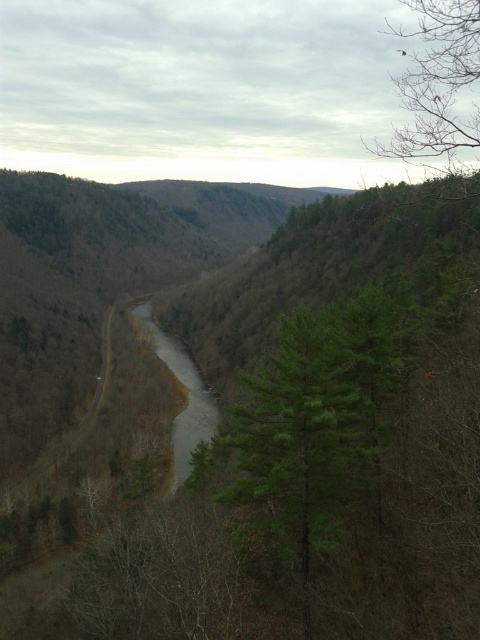
Looking at this image, between green leafy tree at upper right and gray smooth creek at center, which one has less height?

gray smooth creek at center

Does green leafy tree at upper right appear under gray smooth creek at center?

No.

Between point (455, 96) and point (188, 413), which one is positioned in front?

Point (455, 96)

At what (x,y) coordinates should I click in order to perform the action: click on green leafy tree at upper right. Please return your answer as a coordinate pair (x, y). Looking at the image, I should click on (437, 83).